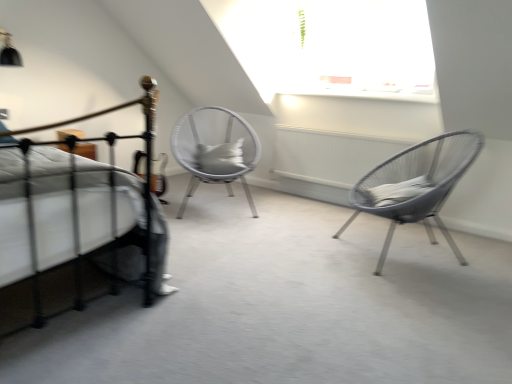
Find the location of `unoccupied region to the right of black metal bed at left`. unoccupied region to the right of black metal bed at left is located at coordinates (223, 302).